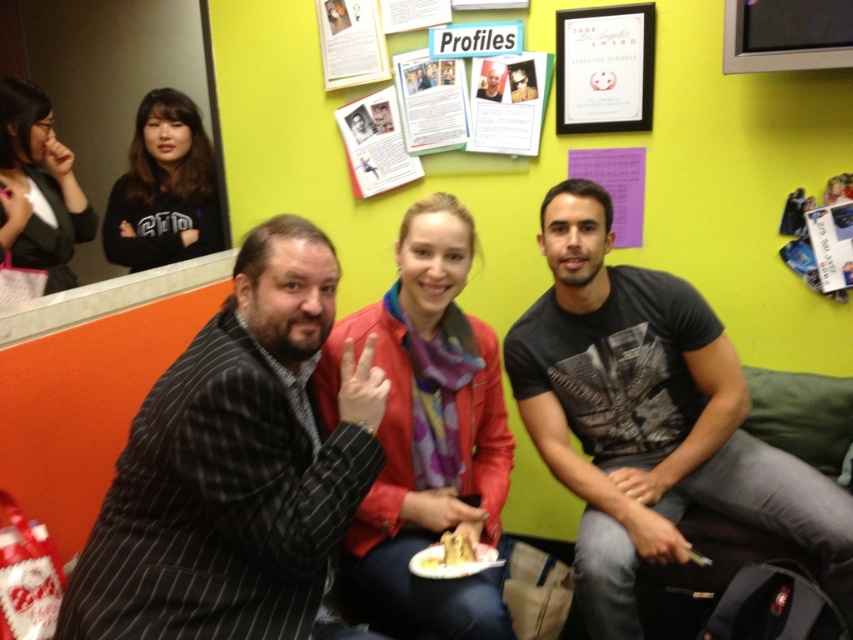
You are a photographer trying to capture a closeup of the yellow crumbly cake at center without including the black matte shirt at upper left in the frame. Is this possible given their positions?

The black matte shirt at upper left is positioned on the left side of yellow crumbly cake at center. Therefore, to avoid including the black matte shirt at upper left in the frame while focusing on the yellow crumbly cake at center, you would need to adjust the camera angle or move the cake to the right so that it is no longer adjacent to the shirt.

You are an interior designer planning to hang a new artwork on the wall where the matte paper poster at upper center is currently displayed. Considering the size of the black pinstripe suit at center, will the new artwork need to be larger or smaller than the existing poster to maintain visual balance?

The black pinstripe suit at center is larger than the matte paper poster at upper center. To maintain visual balance, the new artwork should be smaller than the existing poster.

What is the location of the point with coordinates (x=164, y=188) in the image?

The point with coordinates (x=164, y=188) is located on the black matte shirt at upper left.